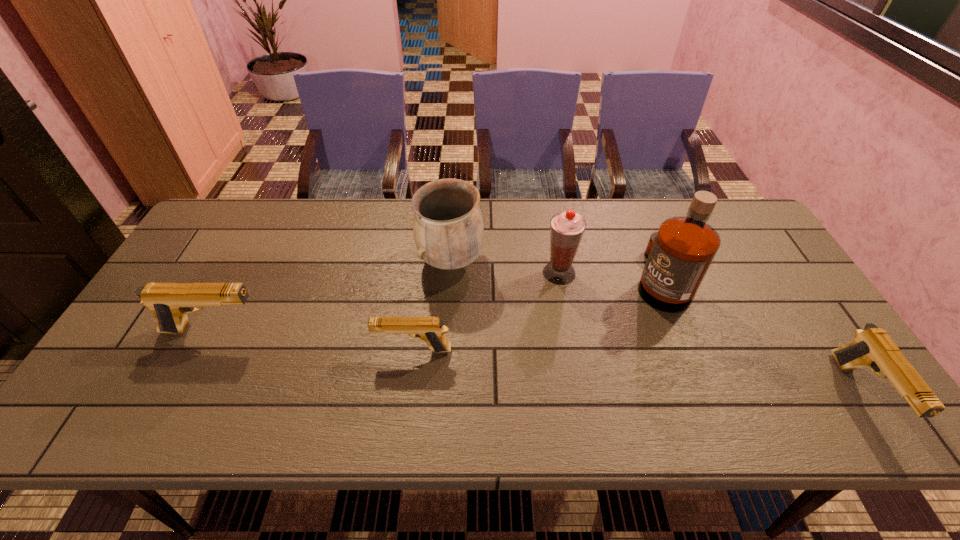
Image resolution: width=960 pixels, height=540 pixels. What are the coordinates of `object that can be found as the fifth closest to the rightmost object` in the screenshot? It's located at (x=170, y=302).

At what (x,y) coordinates should I click in order to perform the action: click on the closest pistol to the urn. Please return your answer as a coordinate pair (x, y). The width and height of the screenshot is (960, 540). Looking at the image, I should click on (431, 330).

The width and height of the screenshot is (960, 540). In order to click on the closest pistol to the leftmost object in this screenshot , I will do `click(431, 330)`.

At what (x,y) coordinates should I click in order to perform the action: click on vacant space that satisfies the following two spatial constraints: 1. on the front side of the urn; 2. at the barrel of the second pistol from right to left. Please return your answer as a coordinate pair (x, y). The image size is (960, 540). Looking at the image, I should click on (445, 350).

Find the location of a particular element. Image resolution: width=960 pixels, height=540 pixels. vacant space that satisfies the following two spatial constraints: 1. on the front side of the third object from right to left; 2. at the barrel of the farthest pistol is located at coordinates (569, 330).